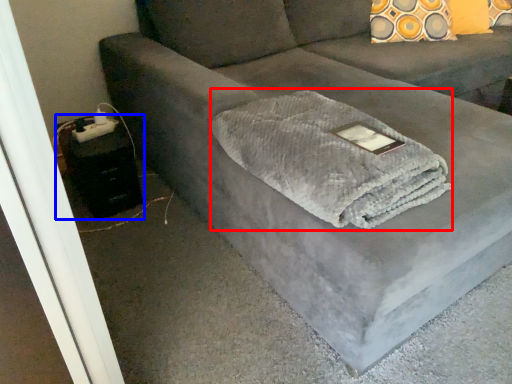
Question: Among these objects, which one is nearest to the camera, bath towel (highlighted by a red box) or table (highlighted by a blue box)?

Choices:
 (A) bath towel
 (B) table

Answer: (A)